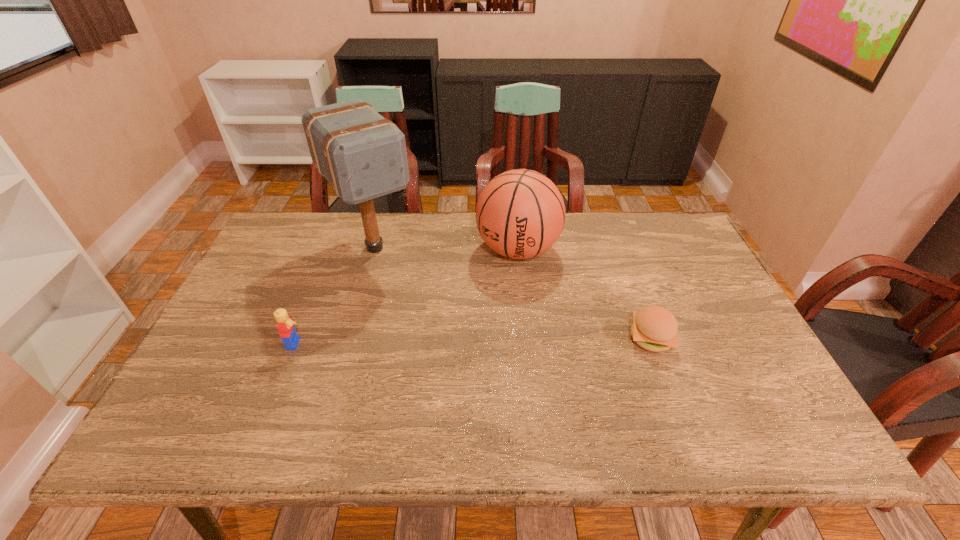
Locate an element on the screen. The height and width of the screenshot is (540, 960). vacant region located 0.200m on the surface of the basketball near the brand logo is located at coordinates (478, 323).

This screenshot has height=540, width=960. In order to click on free point located on the striking surface of the mallet in this screenshot , I will do `click(410, 295)`.

The height and width of the screenshot is (540, 960). Find the location of `vacant space located 0.240m on the striking surface of the mallet`. vacant space located 0.240m on the striking surface of the mallet is located at coordinates (434, 326).

Where is `blank space located on the striking surface of the mallet`? The height and width of the screenshot is (540, 960). blank space located on the striking surface of the mallet is located at coordinates (461, 360).

The height and width of the screenshot is (540, 960). I want to click on basketball that is at the far edge, so click(520, 214).

Where is `mallet that is at the far edge`? mallet that is at the far edge is located at coordinates (363, 156).

Where is `free space at the far edge`? The width and height of the screenshot is (960, 540). free space at the far edge is located at coordinates (348, 214).

You are a GUI agent. You are given a task and a screenshot of the screen. Output one action in this format:
    pyautogui.click(x=<x>, y=<y>)
    Task: Click on the vacant space at the near edge of the desktop
    The image size is (960, 540).
    Given the screenshot: What is the action you would take?
    pyautogui.click(x=526, y=402)

Locate an element on the screen. This screenshot has height=540, width=960. free space at the left edge of the desktop is located at coordinates (245, 286).

This screenshot has width=960, height=540. In order to click on free space at the far right corner of the desktop in this screenshot , I will do `click(669, 241)`.